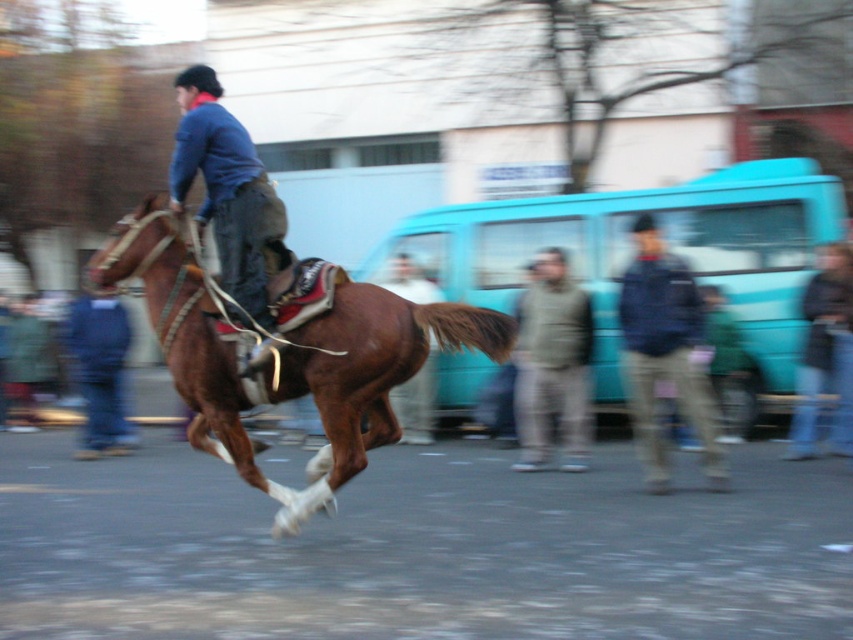
You are a photographer trying to capture a photo of the brown glossy horse at center and the blue denim jacket at upper left. You need to ensure both subjects are fully visible in the frame. Based on their sizes, is there a risk that either subject might be partially cut off due to the camera frame size?

The brown glossy horse at center might be wider than the blue denim jacket at upper left, so there is a risk that the horse could be partially cut off if the camera frame isn not wide enough to accommodate its width.

You are a fashion designer observing the scene. You need to determine which piece of clothing is smaller in size between the blue denim jacket at upper left and the dark blue jacket at center. Which one should you choose to replicate if you want to create a smaller version?

The blue denim jacket at upper left occupies less space than the dark blue jacket at center, so you should choose the blue denim jacket at upper left to replicate for a smaller version.